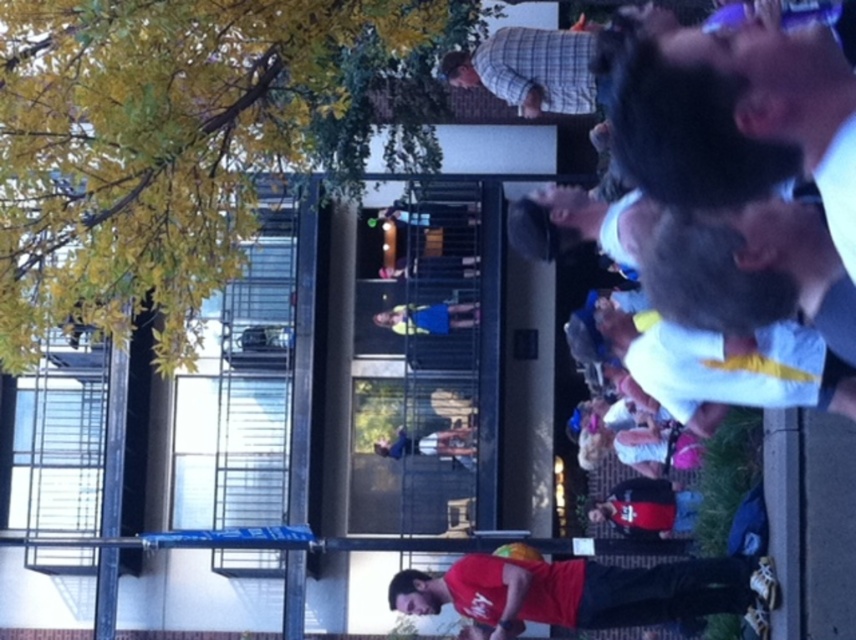
Can you confirm if white matte shirt at upper right is thinner than blue fabric dress at center?

Indeed, white matte shirt at upper right has a lesser width compared to blue fabric dress at center.

Between point (734, 173) and point (462, 326), which one is positioned behind?

Positioned behind is point (462, 326).

Where is `white matte shirt at upper right`? The image size is (856, 640). white matte shirt at upper right is located at coordinates (734, 157).

Is point (652, 612) positioned in front of point (473, 323)?

That is True.

Where is `red matte shirt at lower center`? This screenshot has height=640, width=856. red matte shirt at lower center is located at coordinates (584, 592).

Based on the photo, is white matte shirt at upper right closer to camera compared to red matte shirt at lower center?

Yes.

In the scene shown: Is white matte shirt at upper right shorter than red matte shirt at lower center?

No, white matte shirt at upper right is not shorter than red matte shirt at lower center.

The width and height of the screenshot is (856, 640). I want to click on white matte shirt at upper right, so click(x=734, y=157).